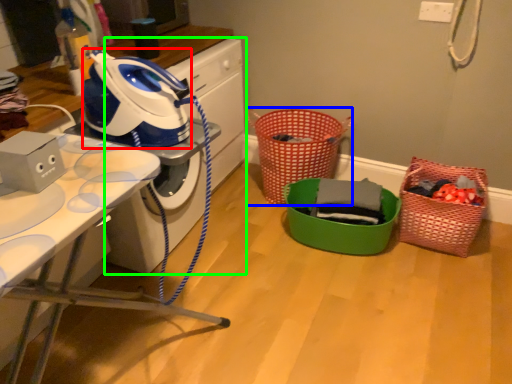
Question: Which is nearer to the appliance (highlighted by a red box)? basket (highlighted by a blue box) or washing machine (highlighted by a green box).

Choices:
 (A) basket
 (B) washing machine

Answer: (B)